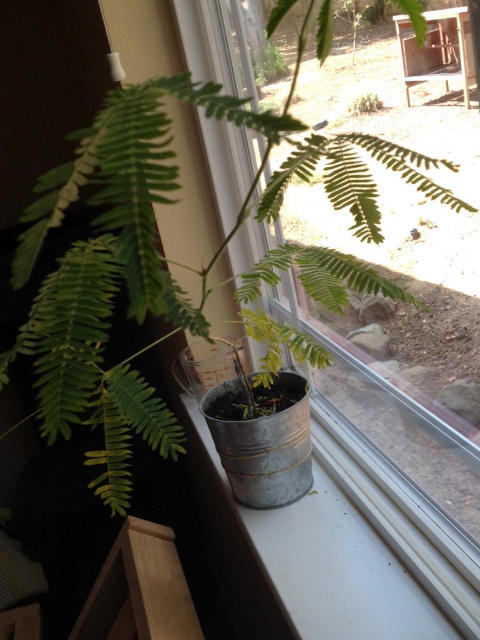
You are a gardener who needs to water the plant. The metallic bucket at center holds water. Can you reach the bucket without moving the metallic gray window sill at lower left?

The metallic bucket at center is closer to the viewer than the metallic gray window sill at lower left, so yes, you can reach the bucket without moving the window sill.

You are standing in the room and looking at the potted plant on the windowsill. There are two points marked on the plant. Which point is closer to you, point (287, 568) or point (213, 465)?

Point (287, 568) is closer to the camera than point (213, 465).

You are organizing a small garden party and need to move the metallic bucket at center and the metallic gray window sill at lower left. Which object requires more space to move around?

The metallic bucket at center requires more space to move around because it is bigger than the metallic gray window sill at lower left.